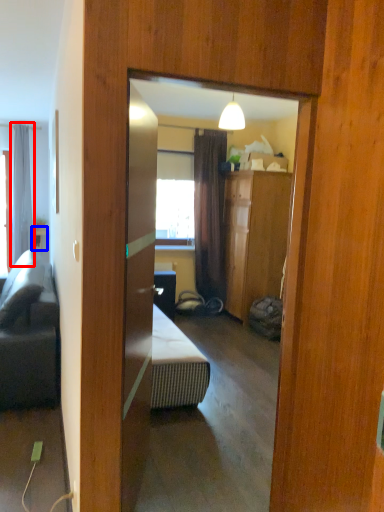
Question: Which point is further to the camera, curtain (highlighted by a red box) or table (highlighted by a blue box)?

Choices:
 (A) curtain
 (B) table

Answer: (B)